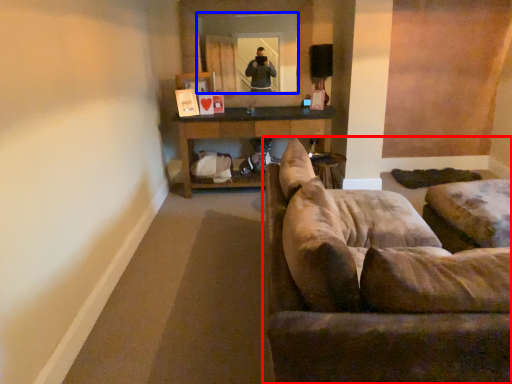
Question: Which of the following is the closest to the observer, studio couch (highlighted by a red box) or mirror (highlighted by a blue box)?

Choices:
 (A) studio couch
 (B) mirror

Answer: (A)